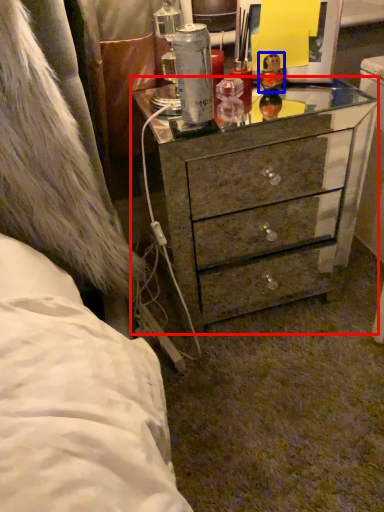
Question: Which object appears closest to the camera in this image, chest of drawers (highlighted by a red box) or toy (highlighted by a blue box)?

Choices:
 (A) chest of drawers
 (B) toy

Answer: (A)